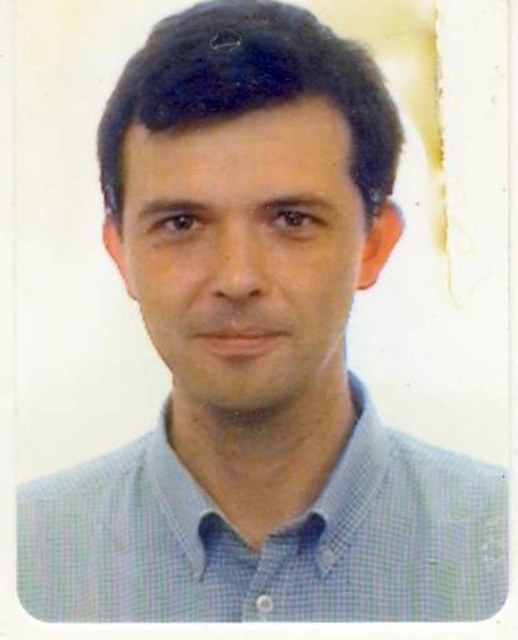
Can you confirm if blue checkered dress shirt at center is positioned below matte blue shirt at center?

Yes.

Is point (371, 480) more distant than point (343, 144)?

Yes, it is behind point (343, 144).

Find the location of a particular element. The height and width of the screenshot is (640, 518). blue checkered dress shirt at center is located at coordinates (267, 540).